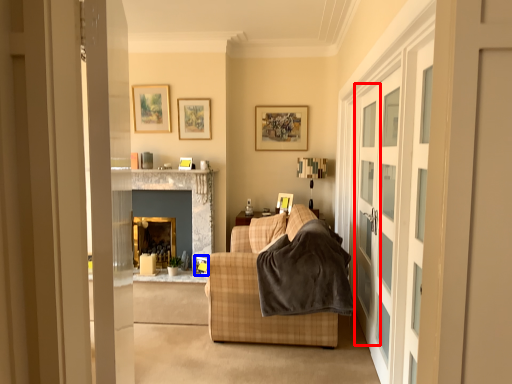
Question: Which object is further to the camera taking this photo, screen door (highlighted by a red box) or picture frame (highlighted by a blue box)?

Choices:
 (A) screen door
 (B) picture frame

Answer: (B)